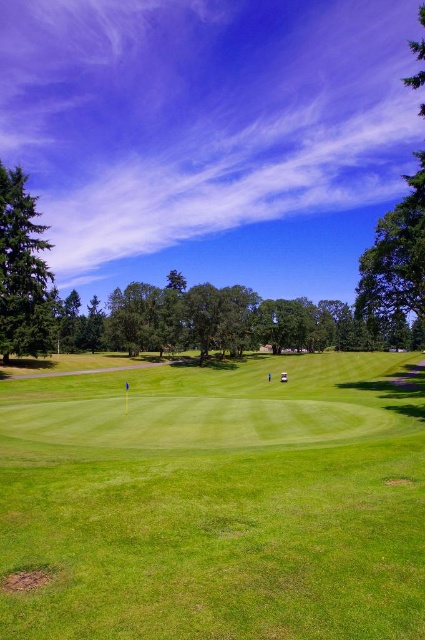
You are a golfer standing on the green grassy golf course at center and want to hit the ball towards the green leafy tree at right. Considering their positions, which object is nearer to you when you aim?

The green grassy golf course at center is closer to the viewer than the green leafy tree at right, so when aiming, the green grassy golf course at center is nearer to you.

You are a golfer standing on the putting green and want to hit the ball towards the hole marked by the yellow flag. There is a green leafy tree at right in your line of sight. Based on its 2D coordinates, can you estimate whether the tree is positioned to the left or right of the flag?

The green leafy tree at right is located at coordinates (394, 262). Since the flag is at the center of the putting green, the tree is positioned to the right of the flag.